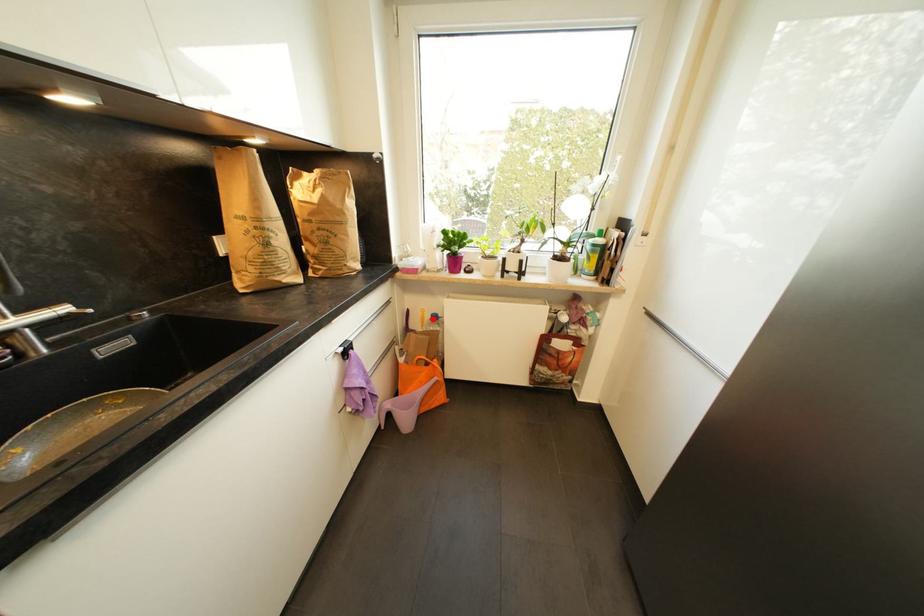
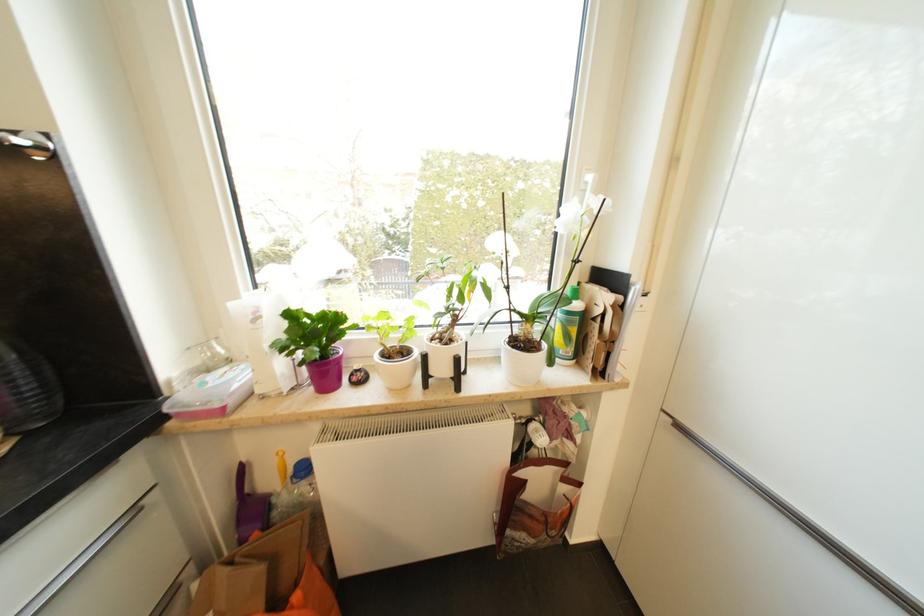
Question: I am providing you with two images of the same scene from different viewpoints. Image1 has a red point marked. In image2, the corresponding 3D location appears at what relative position? Reply with the corresponding letter.

Choices:
 (A) Closer
 (B) Farther

Answer: (B)